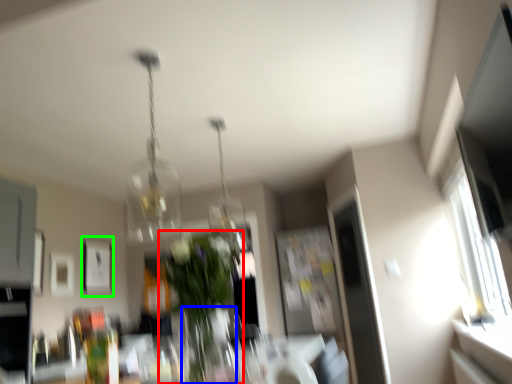
Question: Which is nearer to the houseplant (highlighted by a red box)? glass vase (highlighted by a blue box) or picture frame (highlighted by a green box).

Choices:
 (A) glass vase
 (B) picture frame

Answer: (A)